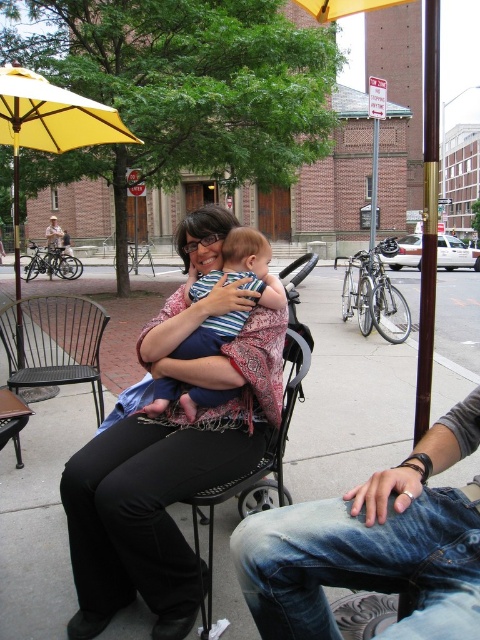
Can you confirm if matte pink shawl at center is thinner than black metal chair at left?

Incorrect, matte pink shawl at center's width is not less than black metal chair at left's.

Locate an element on the screen. Image resolution: width=480 pixels, height=640 pixels. matte pink shawl at center is located at coordinates point(168,467).

Is yellow fabric umbrella at upper left positioned at the back of striped fabric baby at center?

Yes, it is.

Is point (48, 150) positioned before point (220, 320)?

No, (48, 150) is behind (220, 320).

You are a GUI agent. You are given a task and a screenshot of the screen. Output one action in this format:
    pyautogui.click(x=<x>, y=<y>)
    Task: Click on the yellow fabric umbrella at upper left
    This screenshot has width=480, height=640.
    Given the screenshot: What is the action you would take?
    point(49,125)

Does jeans at lower right appear on the right side of striped fabric baby at center?

Indeed, jeans at lower right is positioned on the right side of striped fabric baby at center.

Consider the image. Is jeans at lower right above striped fabric baby at center?

Incorrect, jeans at lower right is not positioned above striped fabric baby at center.

Between point (404, 634) and point (259, 291), which one is positioned in front?

Point (404, 634) is more forward.

Find the location of `jeans at lower right`. jeans at lower right is located at coordinates 373,545.